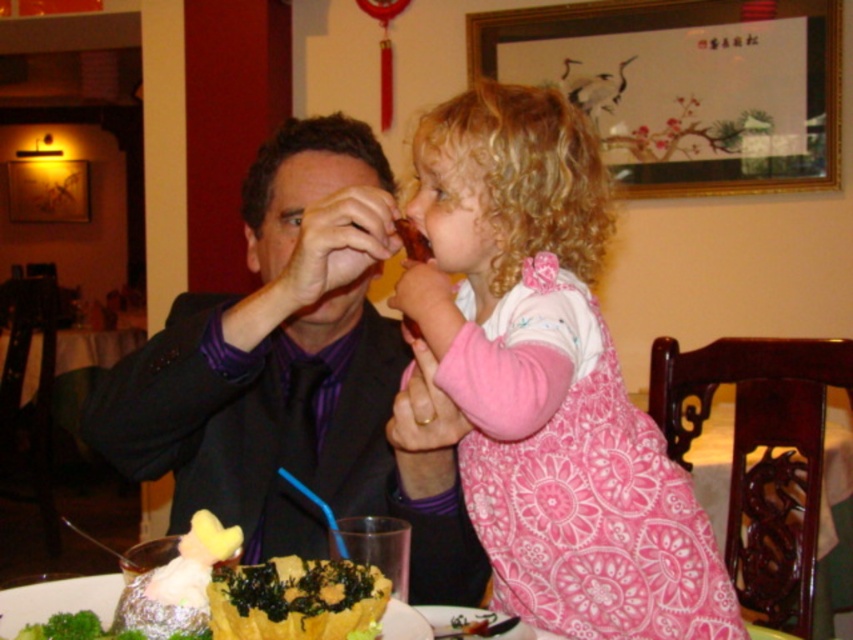
Is point (259, 540) less distant than point (402, 240)?

No, (259, 540) is behind (402, 240).

Can you confirm if matte black suit at center is smaller than matte brown food at upper center?

Incorrect, matte black suit at center is not smaller in size than matte brown food at upper center.

This screenshot has height=640, width=853. What do you see at coordinates (292, 376) in the screenshot?
I see `matte black suit at center` at bounding box center [292, 376].

Locate an element on the screen. matte black suit at center is located at coordinates (292, 376).

Which of these two, pink floral dress at upper right or shiny foil bowl at lower left, stands taller?

With more height is pink floral dress at upper right.

The height and width of the screenshot is (640, 853). What do you see at coordinates (550, 380) in the screenshot?
I see `pink floral dress at upper right` at bounding box center [550, 380].

In order to click on pink floral dress at upper right in this screenshot , I will do `click(550, 380)`.

Can you confirm if shiny foil bowl at lower left is wider than matte brown food at upper center?

Yes.

Is shiny foil bowl at lower left bigger than matte brown food at upper center?

Indeed, shiny foil bowl at lower left has a larger size compared to matte brown food at upper center.

Does point (303, 624) lie behind point (413, 225)?

No, (303, 624) is in front of (413, 225).

At what (x,y) coordinates should I click in order to perform the action: click on shiny foil bowl at lower left. Please return your answer as a coordinate pair (x, y). Image resolution: width=853 pixels, height=640 pixels. Looking at the image, I should click on (177, 602).